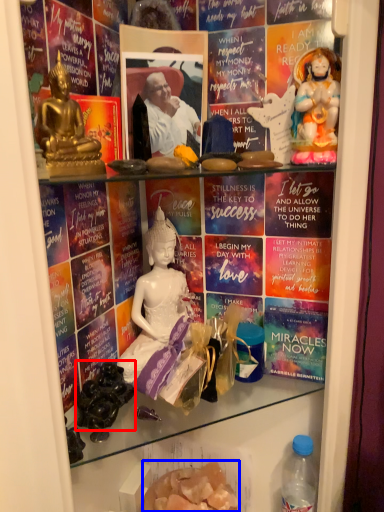
Question: Which point is further to the camera, food (highlighted by a red box) or food (highlighted by a blue box)?

Choices:
 (A) food
 (B) food

Answer: (B)